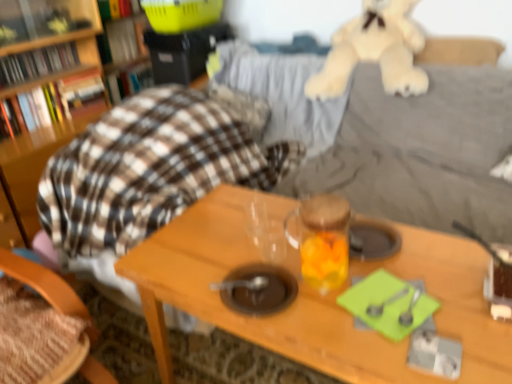
At what (x,y) coordinates should I click in order to perform the action: click on vacant area to the left of transparent glass jar at center. Please return your answer as a coordinate pair (x, y). Looking at the image, I should click on (258, 271).